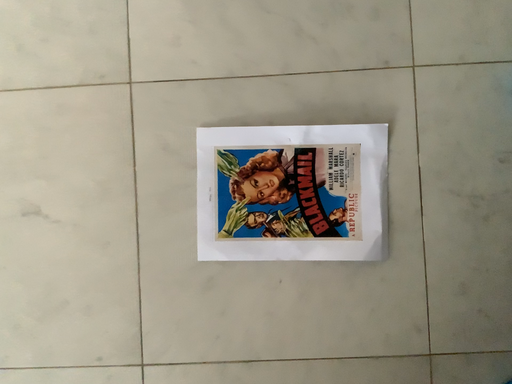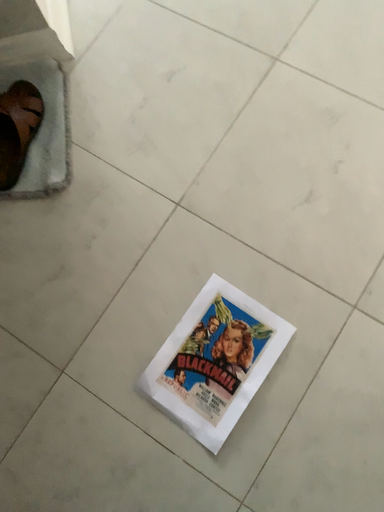
Question: How did the camera likely rotate when shooting the video?

Choices:
 (A) rotated upward
 (B) rotated downward

Answer: (A)